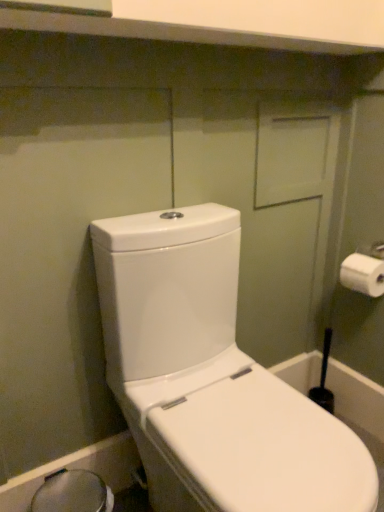
Question: From a real-world perspective, is transparent plastic bidet at lower left above or below white glossy toilet at left?

Choices:
 (A) below
 (B) above

Answer: (A)

Question: Which is correct: transparent plastic bidet at lower left is inside white glossy toilet at left, or outside of it?

Choices:
 (A) inside
 (B) outside

Answer: (B)

Question: Considering the real-world distances, which object is closest to the transparent plastic bidet at lower left?

Choices:
 (A) white glossy toilet at left
 (B) white matte toilet paper at right

Answer: (A)

Question: Estimate the real-world distances between objects in this image. Which object is closer to the white glossy toilet at left?

Choices:
 (A) transparent plastic bidet at lower left
 (B) white matte toilet paper at right

Answer: (A)